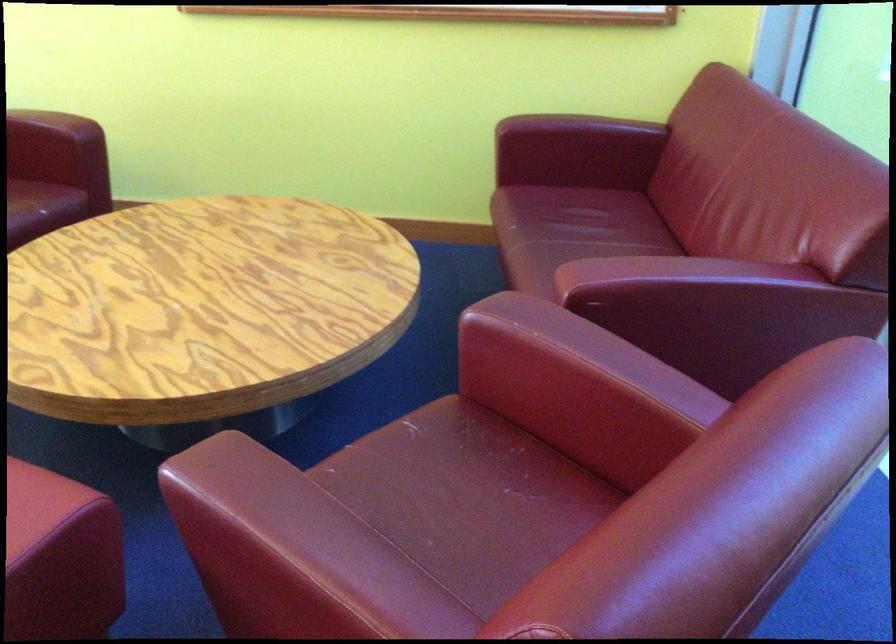
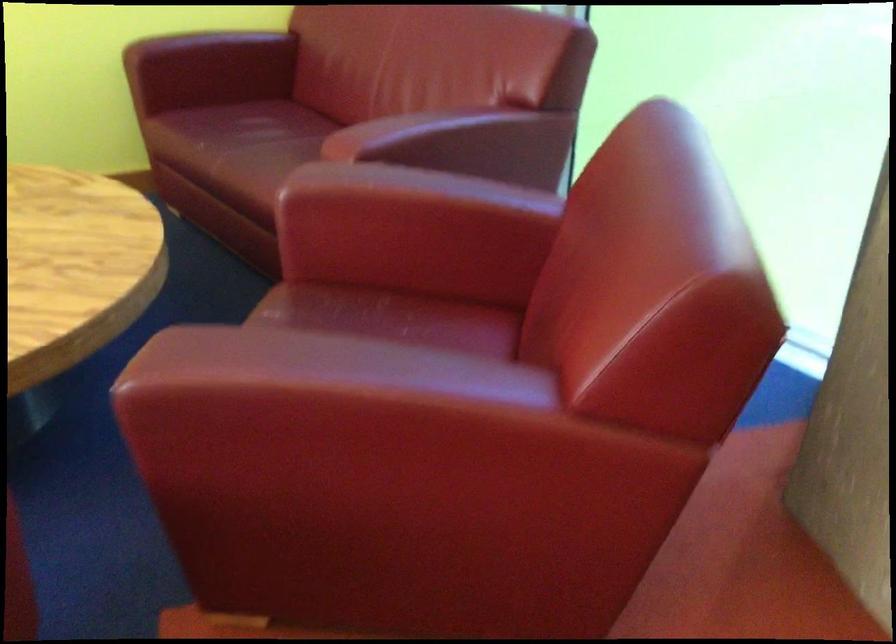
In the second image, find the point that corresponds to point 556,392 in the first image.

(412, 231)